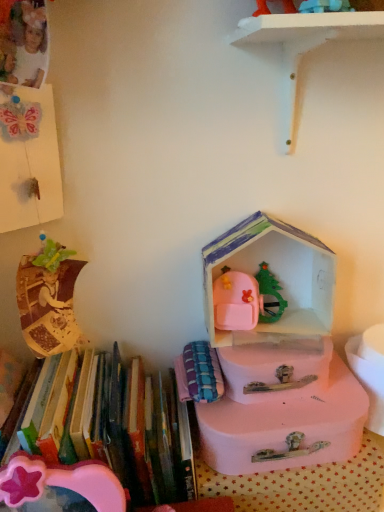
Question: Is plaid fabric book at center, which ranks as the 2th book in left-to-right order, behind pink plastic box at center?

Choices:
 (A) no
 (B) yes

Answer: (A)

Question: Considering the relative positions of plaid fabric book at center, the first book viewed from the right, and pink plastic box at center in the image provided, is plaid fabric book at center, the first book viewed from the right, to the left of pink plastic box at center from the viewer's perspective?

Choices:
 (A) no
 (B) yes

Answer: (B)

Question: Does plaid fabric book at center, the first book viewed from the right, appear on the right side of pink plastic box at center?

Choices:
 (A) no
 (B) yes

Answer: (A)

Question: Is plaid fabric book at center, the first book viewed from the right, closer to camera compared to pink plastic box at center?

Choices:
 (A) no
 (B) yes

Answer: (B)

Question: From the image's perspective, is plaid fabric book at center, which ranks as the 2th book in left-to-right order, located beneath pink plastic box at center?

Choices:
 (A) no
 (B) yes

Answer: (B)

Question: From a real-world perspective, is plaid fabric book at center, which ranks as the 2th book in left-to-right order, below pink plastic box at center?

Choices:
 (A) yes
 (B) no

Answer: (A)

Question: From a real-world perspective, is hardcover books at left, placed as the first book when sorted from left to right, located beneath plaid fabric book at center, the first book viewed from the right?

Choices:
 (A) yes
 (B) no

Answer: (A)

Question: From the image's perspective, would you say hardcover books at left, placed as the 2th book when sorted from right to left, is shown under plaid fabric book at center, which ranks as the 2th book in left-to-right order?

Choices:
 (A) yes
 (B) no

Answer: (A)

Question: Does hardcover books at left, placed as the 2th book when sorted from right to left, have a smaller size compared to plaid fabric book at center, which ranks as the 2th book in left-to-right order?

Choices:
 (A) no
 (B) yes

Answer: (A)

Question: Does hardcover books at left, placed as the 2th book when sorted from right to left, lie in front of plaid fabric book at center, which ranks as the 2th book in left-to-right order?

Choices:
 (A) no
 (B) yes

Answer: (B)

Question: Considering the relative sizes of hardcover books at left, placed as the first book when sorted from left to right, and plaid fabric book at center, the first book viewed from the right, in the image provided, is hardcover books at left, placed as the first book when sorted from left to right, bigger than plaid fabric book at center, the first book viewed from the right,?

Choices:
 (A) no
 (B) yes

Answer: (B)

Question: Does hardcover books at left, placed as the 2th book when sorted from right to left, have a greater width compared to plaid fabric book at center, which ranks as the 2th book in left-to-right order?

Choices:
 (A) no
 (B) yes

Answer: (B)

Question: Is plaid fabric book at center, the first book viewed from the right, positioned far away from hardcover books at left, placed as the 2th book when sorted from right to left?

Choices:
 (A) no
 (B) yes

Answer: (A)